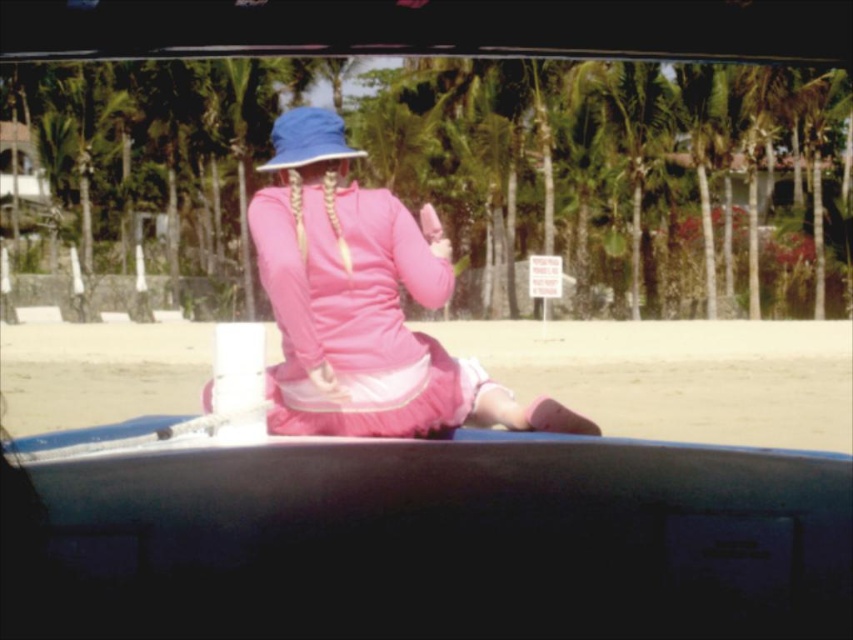
Question: Is blue plastic canoe at center to the left of pink matte dress at center from the viewer's perspective?

Choices:
 (A) no
 (B) yes

Answer: (A)

Question: Which object is positioned closest to the blue plastic canoe at center?

Choices:
 (A) pink fabric skirt at center
 (B) blue fabric hat at center
 (C) pink matte dress at center

Answer: (C)

Question: In this image, where is pink matte dress at center located relative to blue fabric hat at center?

Choices:
 (A) below
 (B) above

Answer: (A)

Question: Is blue plastic canoe at center to the right of pink fabric skirt at center from the viewer's perspective?

Choices:
 (A) yes
 (B) no

Answer: (A)

Question: Considering the real-world distances, which object is closest to the pink fabric skirt at center?

Choices:
 (A) pink matte dress at center
 (B) blue fabric hat at center

Answer: (B)

Question: Which of the following is the closest to the observer?

Choices:
 (A) (296, 118)
 (B) (799, 406)
 (C) (262, 212)

Answer: (C)